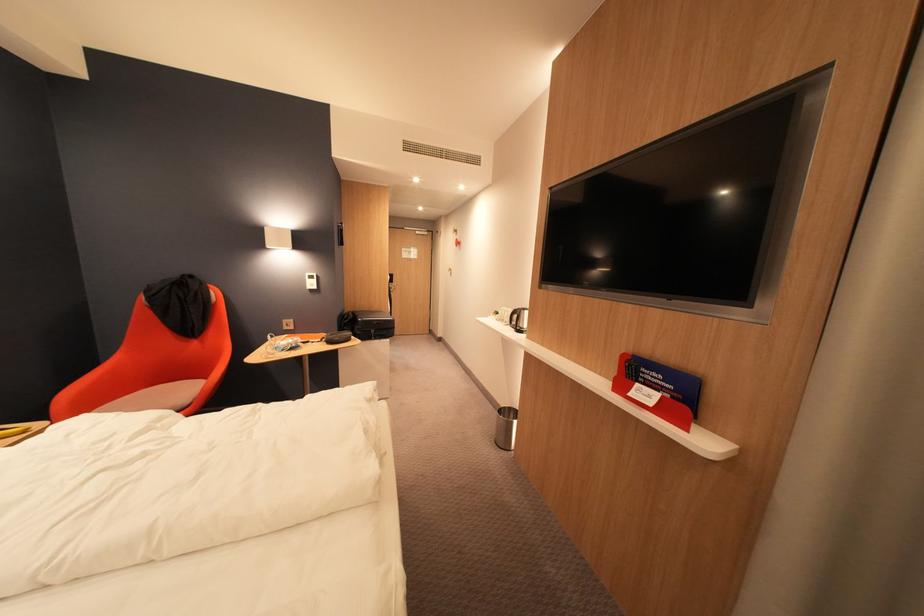
Find where to turn the metal door handle. Please return your answer as a coordinate pair (x, y).

(391, 288)